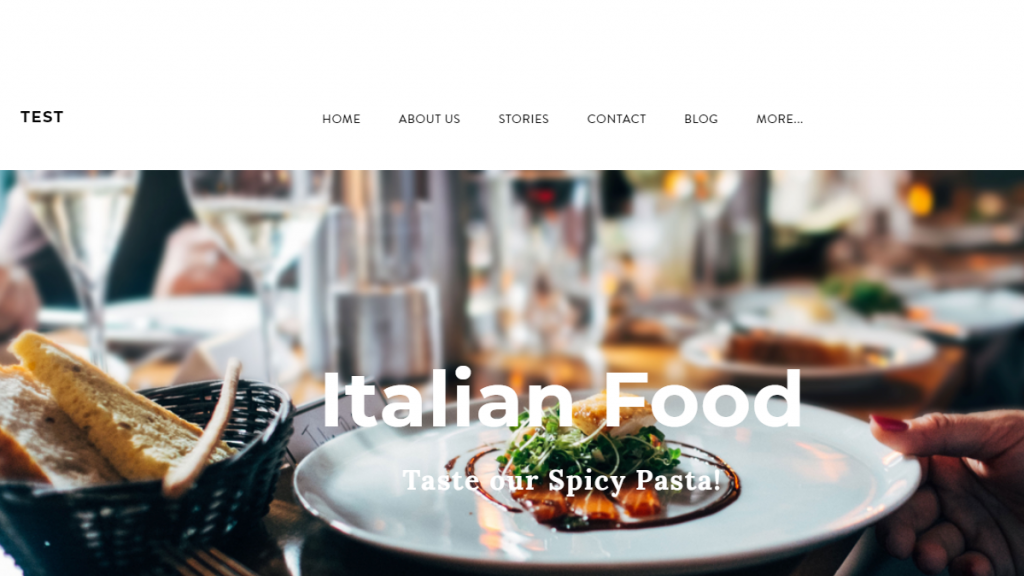
The image size is (1024, 576). In order to click on table in this screenshot , I will do `click(827, 553)`.